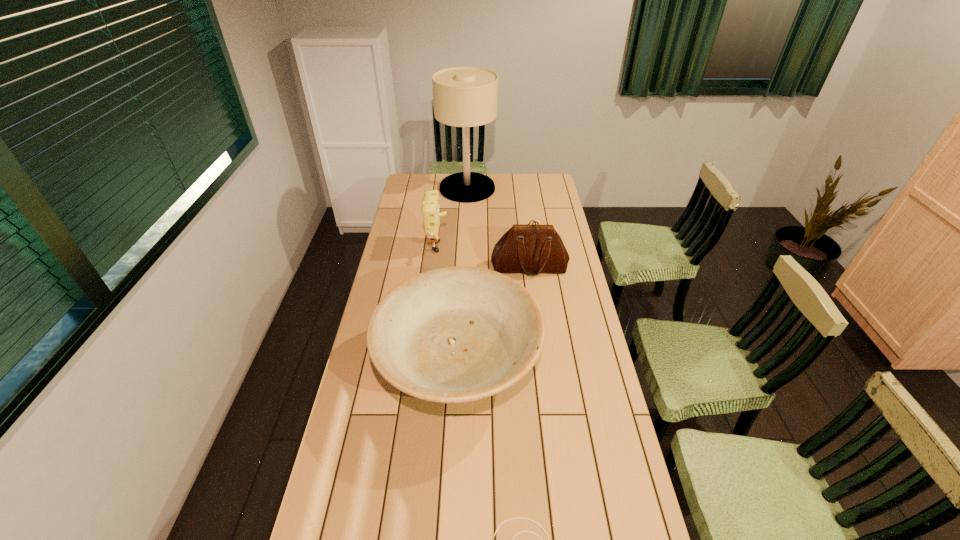
Locate an element on the screen. The height and width of the screenshot is (540, 960). object at the left edge is located at coordinates (458, 334).

Identify the location of object positioned at the right edge. (532, 249).

Locate an element on the screen. This screenshot has height=540, width=960. free space at the far edge of the desktop is located at coordinates (499, 184).

In the image, there is a desktop. Where is `free region at the left edge`? free region at the left edge is located at coordinates (350, 397).

This screenshot has width=960, height=540. Find the location of `free location at the right edge`. free location at the right edge is located at coordinates (544, 275).

Where is `free space at the far left corner`? free space at the far left corner is located at coordinates (415, 176).

Where is `blank region between the shoulder bag and the tallest object`? Image resolution: width=960 pixels, height=540 pixels. blank region between the shoulder bag and the tallest object is located at coordinates (498, 227).

Identify the location of free space between the shoulder bag and the farthest object. This screenshot has height=540, width=960. (498, 227).

I want to click on empty space between the sponge and the shoulder bag, so click(x=484, y=258).

At what (x,y) coordinates should I click in order to perform the action: click on free spot between the sponge and the shoulder bag. Please return your answer as a coordinate pair (x, y). Looking at the image, I should click on click(484, 258).